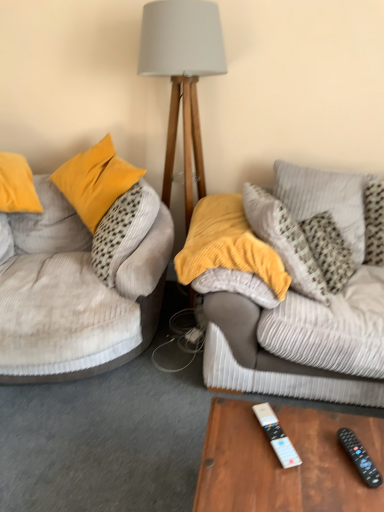
Question: Considering the relative sizes of black plastic remote control at lower right, the first remote control when ordered from right to left, and corduroy pillow at upper right, arranged as the second pillow when viewed from the left, in the image provided, is black plastic remote control at lower right, the first remote control when ordered from right to left, shorter than corduroy pillow at upper right, arranged as the second pillow when viewed from the left,?

Choices:
 (A) no
 (B) yes

Answer: (B)

Question: Could corduroy pillow at upper right, acting as the first pillow starting from the right, be considered to be inside black plastic remote control at lower right, positioned as the 2th remote control in left-to-right order?

Choices:
 (A) no
 (B) yes

Answer: (A)

Question: Can you confirm if black plastic remote control at lower right, the first remote control when ordered from right to left, is thinner than corduroy pillow at upper right, acting as the first pillow starting from the right?

Choices:
 (A) yes
 (B) no

Answer: (A)

Question: Is there a large distance between black plastic remote control at lower right, the first remote control when ordered from right to left, and corduroy pillow at upper right, acting as the first pillow starting from the right?

Choices:
 (A) no
 (B) yes

Answer: (B)

Question: Is black plastic remote control at lower right, the first remote control when ordered from right to left, at the left side of corduroy pillow at upper right, acting as the first pillow starting from the right?

Choices:
 (A) yes
 (B) no

Answer: (A)

Question: From a real-world perspective, is black plastic remote control at lower right, the first remote control when ordered from right to left, on corduroy pillow at upper right, arranged as the second pillow when viewed from the left?

Choices:
 (A) no
 (B) yes

Answer: (A)

Question: Considering the relative sizes of velvety yellow pillow at center, the second pillow from the right, and velvet beige couch at left in the image provided, is velvety yellow pillow at center, the second pillow from the right, wider than velvet beige couch at left?

Choices:
 (A) no
 (B) yes

Answer: (A)

Question: Does velvety yellow pillow at center, the second pillow from the right, have a lesser width compared to velvet beige couch at left?

Choices:
 (A) no
 (B) yes

Answer: (B)

Question: Is velvety yellow pillow at center, the second pillow from the right, behind velvet beige couch at left?

Choices:
 (A) yes
 (B) no

Answer: (A)

Question: Does velvety yellow pillow at center, the second pillow from the right, have a lesser height compared to velvet beige couch at left?

Choices:
 (A) yes
 (B) no

Answer: (A)

Question: Considering the relative positions of velvety yellow pillow at center, the second pillow from the right, and velvet beige couch at left in the image provided, is velvety yellow pillow at center, the second pillow from the right, to the right of velvet beige couch at left from the viewer's perspective?

Choices:
 (A) yes
 (B) no

Answer: (A)

Question: Is velvet beige couch at left inside velvety yellow pillow at center, which is the first pillow from left to right?

Choices:
 (A) yes
 (B) no

Answer: (B)

Question: Is light gray fabric lampshade at center thinner than velvety yellow pillow at center, the second pillow from the right?

Choices:
 (A) yes
 (B) no

Answer: (A)